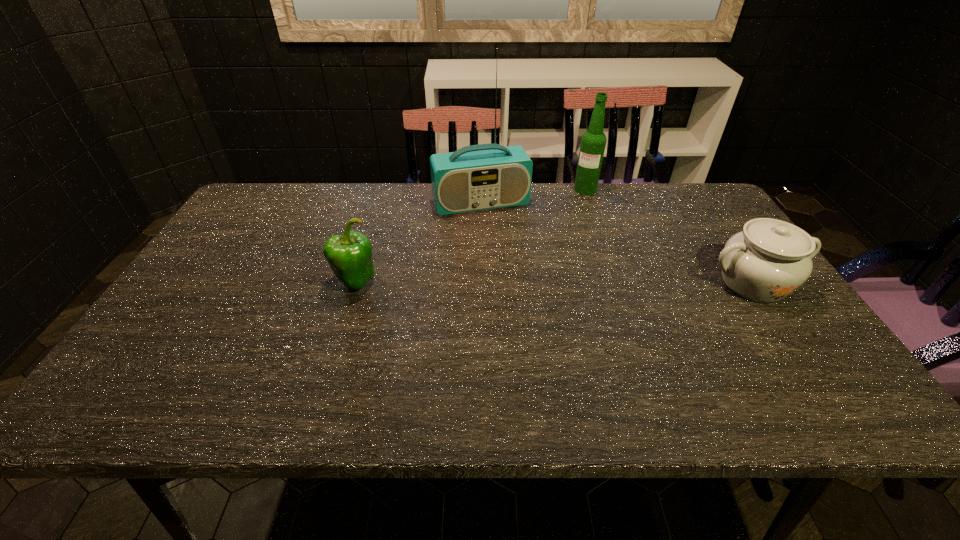
What are the coordinates of `the leftmost object` in the screenshot? It's located at (349, 255).

Image resolution: width=960 pixels, height=540 pixels. I want to click on the rightmost object, so click(x=770, y=259).

You are a GUI agent. You are given a task and a screenshot of the screen. Output one action in this format:
    pyautogui.click(x=<x>, y=<y>)
    Task: Click on the tallest object
    This screenshot has width=960, height=540.
    Given the screenshot: What is the action you would take?
    pyautogui.click(x=478, y=177)

I want to click on the third object from right to left, so click(478, 177).

Locate an element on the screen. The width and height of the screenshot is (960, 540). beer bottle is located at coordinates (593, 141).

Find the location of `the second object from right to left`. the second object from right to left is located at coordinates (593, 141).

Where is `free space located on the back of the bell pepper`? free space located on the back of the bell pepper is located at coordinates 372,229.

Locate an element on the screen. The height and width of the screenshot is (540, 960). vacant space located on the back of the rightmost object is located at coordinates (727, 244).

You are a GUI agent. You are given a task and a screenshot of the screen. Output one action in this format:
    pyautogui.click(x=<x>, y=<y>)
    Task: Click on the vacant position located 0.140m on the front panel of the tallest object
    The width and height of the screenshot is (960, 540).
    Given the screenshot: What is the action you would take?
    pyautogui.click(x=504, y=245)

Where is `free spot located 0.230m on the front panel of the tallest object`? The height and width of the screenshot is (540, 960). free spot located 0.230m on the front panel of the tallest object is located at coordinates (513, 265).